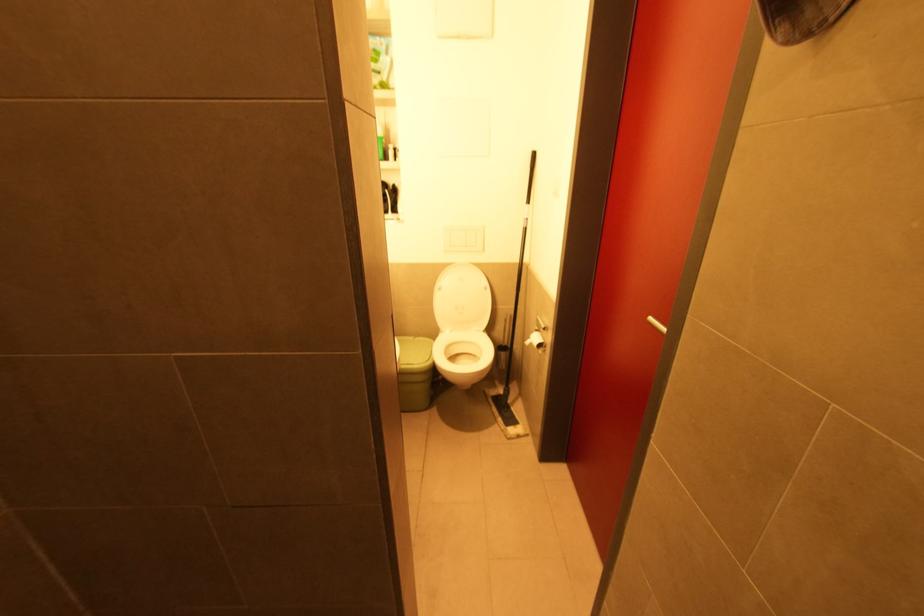
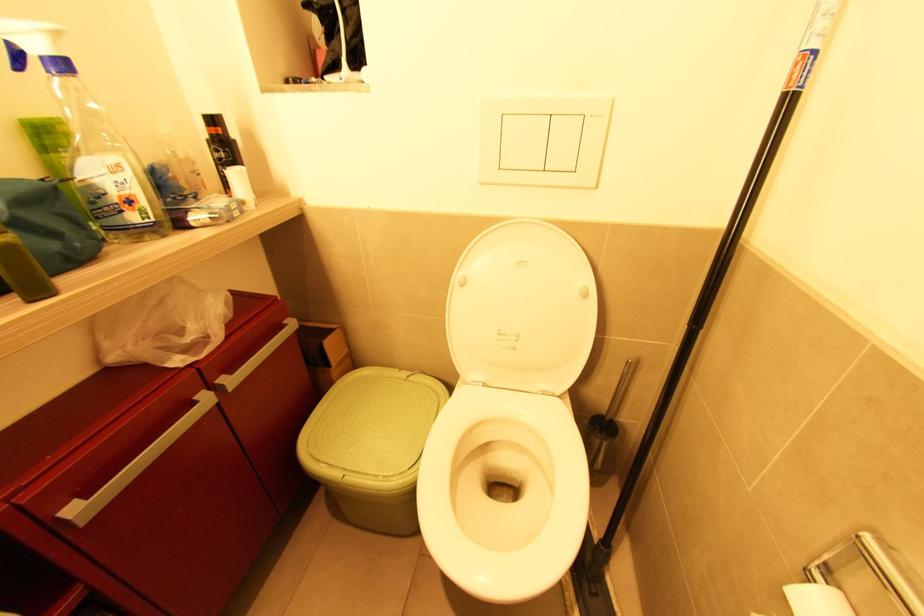
Question: The images are taken continuously from a first-person perspective. In which direction are you moving?

Choices:
 (A) Left
 (B) Right
 (C) Forward
 (D) Backward

Answer: (C)